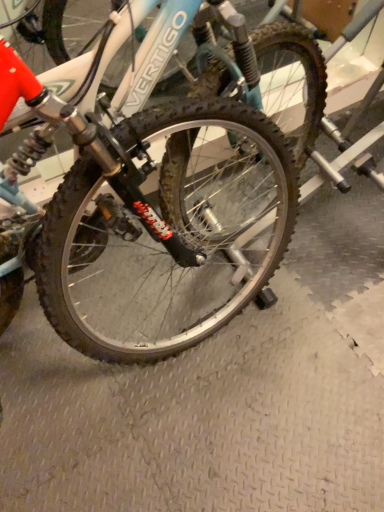
Identify the location of matte black tire at center. (177, 184).

What do you see at coordinates (177, 184) in the screenshot?
I see `matte black tire at center` at bounding box center [177, 184].

What is the approximate width of matte black tire at center?

The width of matte black tire at center is 23.58 inches.

At what (x,y) coordinates should I click in order to perform the action: click on matte black tire at center. Please return your answer as a coordinate pair (x, y). This screenshot has width=384, height=512. Looking at the image, I should click on (177, 184).